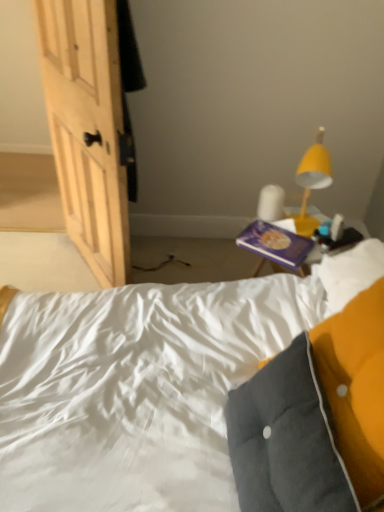
The width and height of the screenshot is (384, 512). Identify the location of free space above purple matte book at upper right (from a real-world perspective). (x=278, y=239).